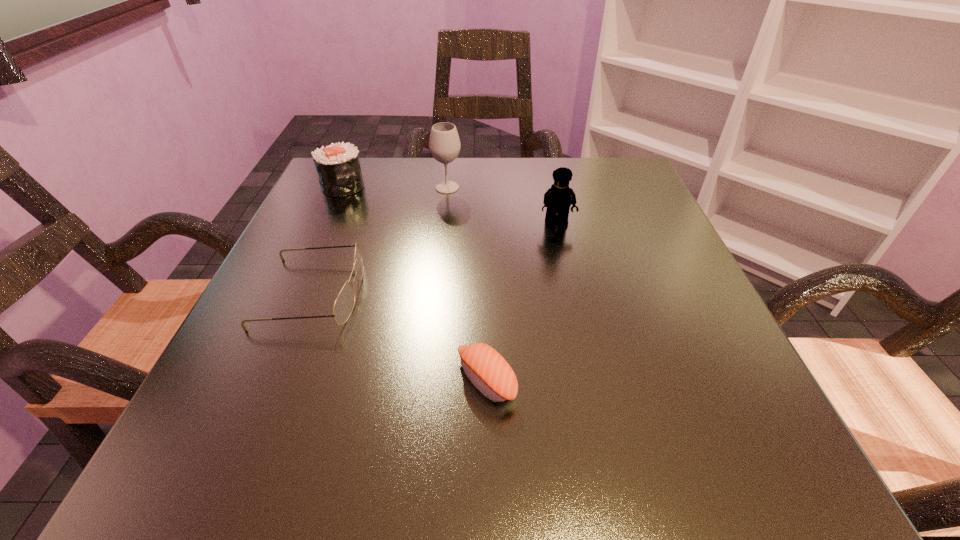
Find the location of a particular element. The height and width of the screenshot is (540, 960). the third object from right to left is located at coordinates (444, 143).

The image size is (960, 540). Find the location of `the tallest object`. the tallest object is located at coordinates (444, 143).

Locate an element on the screen. This screenshot has width=960, height=540. the rightmost object is located at coordinates (558, 199).

Find the location of a particular element. Lego is located at coordinates (558, 199).

Image resolution: width=960 pixels, height=540 pixels. I want to click on the third shortest object, so click(338, 167).

Where is `the left sushi`? The width and height of the screenshot is (960, 540). the left sushi is located at coordinates (338, 167).

In order to click on the fourth object from left to right in this screenshot , I will do `click(490, 373)`.

The image size is (960, 540). Identify the location of the nearest object. (490, 373).

Find the location of a particular element. The image size is (960, 540). the fourth farthest object is located at coordinates (343, 306).

The image size is (960, 540). What are the coordinates of `vacant space located 0.060m on the back of the third object from left to right` in the screenshot? It's located at (449, 167).